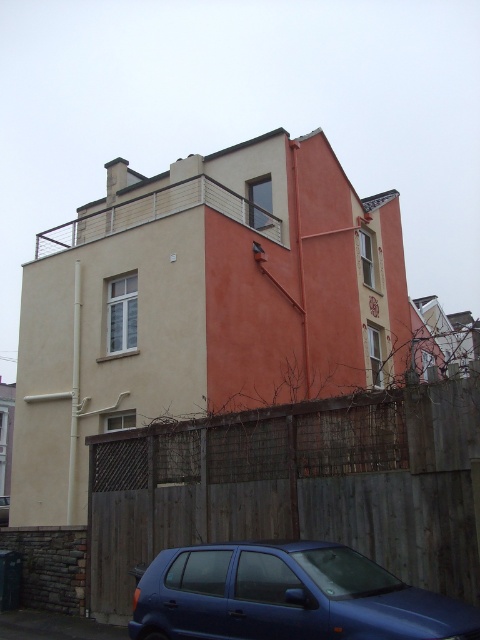
You are a delivery driver who needs to park your vehicle in the parking lot behind the two cars shown in the image. The parking space behind the blue matte car at lower center is available. Can you park your vehicle there without moving the matte blue hatchback at lower center?

The matte blue hatchback at lower center is in front of the blue matte car at lower center, so you can park behind the blue matte car at lower center without moving the matte blue hatchback at lower center.

You are a visitor arriving at the residential building and see the wooden fence at lower center and the blue matte car at lower center. From your perspective, which object is located to the right?

The wooden fence at lower center is positioned on the right side of the blue matte car at lower center, so the wooden fence at lower center is located to the right.

You are a delivery person approaching the house and need to park your blue matte car at lower center. There is a wooden fence at lower center blocking the entrance. Can you drive around the fence to park your car?

The wooden fence at lower center is in front of blue matte car at lower center, so you cannot drive around the fence to park your car because the fence is blocking the entrance.